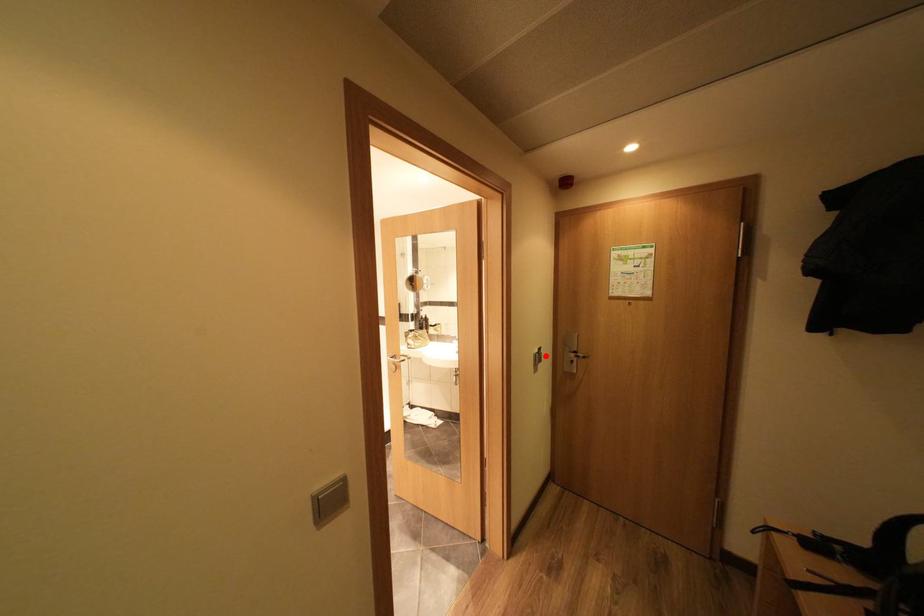
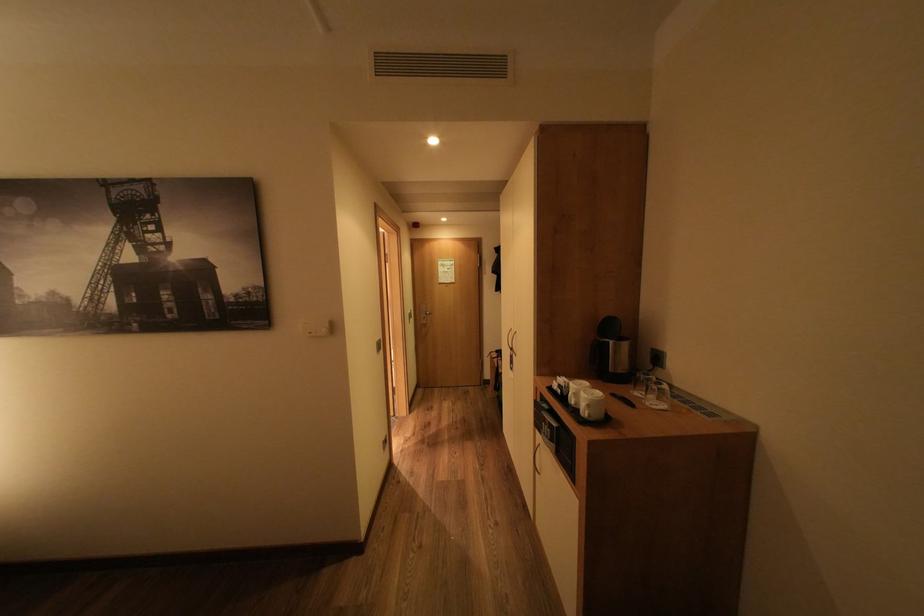
Where in the second image is the point corresponding to the highlighted location from the first image?

(419, 315)